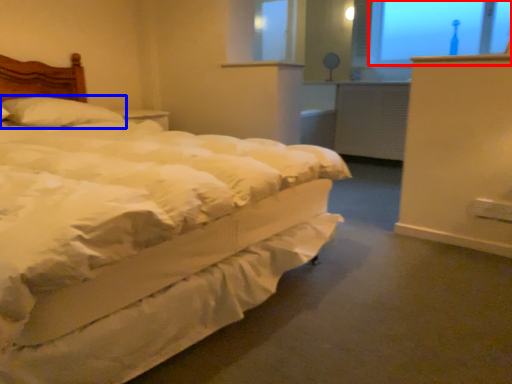
Question: Which object is closer to the camera taking this photo, window screen (highlighted by a red box) or pillow (highlighted by a blue box)?

Choices:
 (A) window screen
 (B) pillow

Answer: (B)